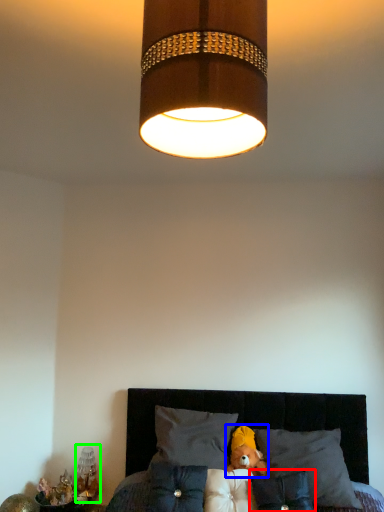
Question: Considering the real-world distances, which object is farthest from pillow (highlighted by a red box)? teddy (highlighted by a blue box) or bedside lamp (highlighted by a green box)?

Choices:
 (A) teddy
 (B) bedside lamp

Answer: (B)